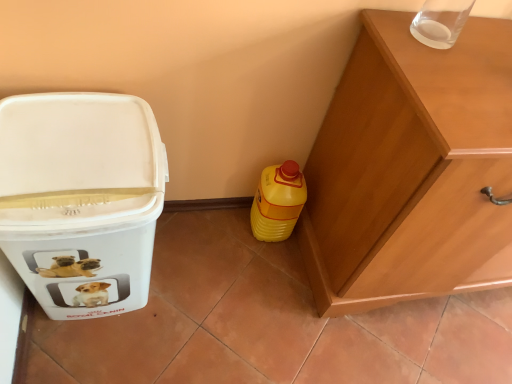
Question: Is point (419, 135) positioned closer to the camera than point (96, 233)?

Choices:
 (A) farther
 (B) closer

Answer: (B)

Question: Based on their positions, is wooden cabinet at right located to the left or right of white plastic container at left?

Choices:
 (A) right
 (B) left

Answer: (A)

Question: Based on their relative distances, which object is farther from the yellow plastic bottle at lower right?

Choices:
 (A) white plastic container at left
 (B) wooden cabinet at right

Answer: (A)

Question: Which of these objects is positioned closest to the white plastic container at left?

Choices:
 (A) wooden cabinet at right
 (B) yellow plastic bottle at lower right

Answer: (B)